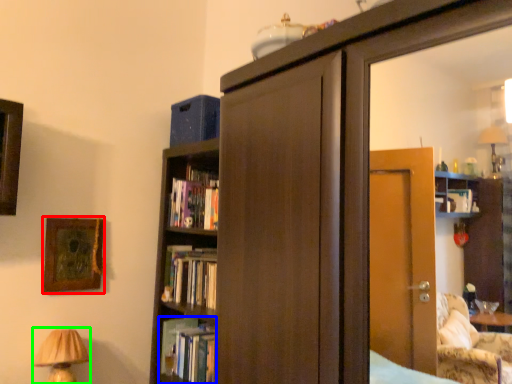
Question: Considering the real-world distances, which object is farthest from picture frame (highlighted by a red box)? book (highlighted by a blue box) or table lamp (highlighted by a green box)?

Choices:
 (A) book
 (B) table lamp

Answer: (A)